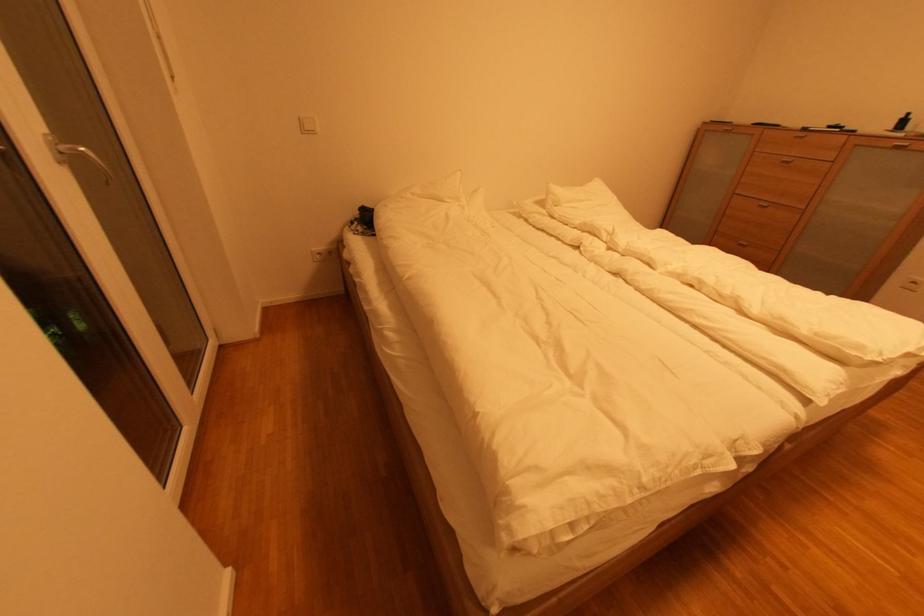
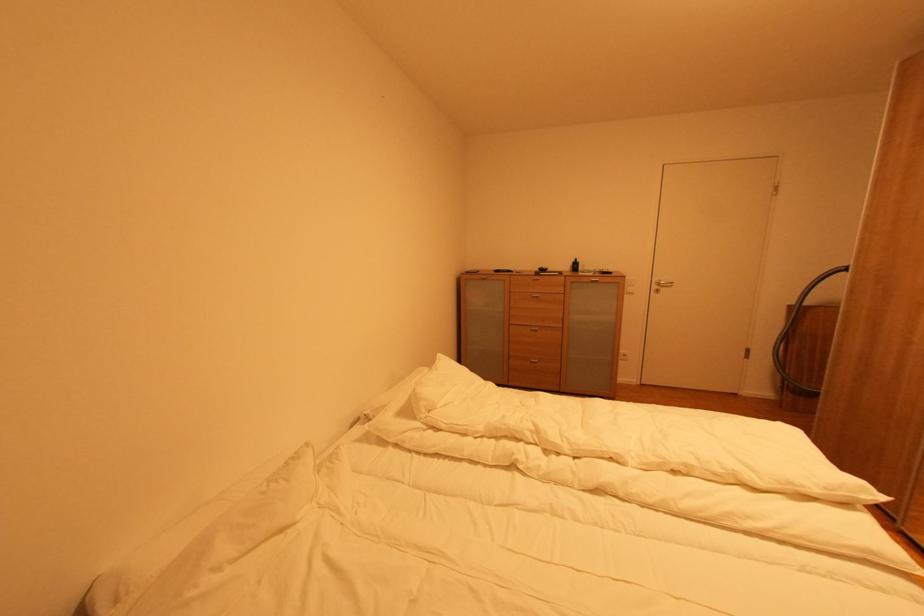
Where in the second image is the point corresponding to (x=795, y=163) from the first image?

(542, 298)